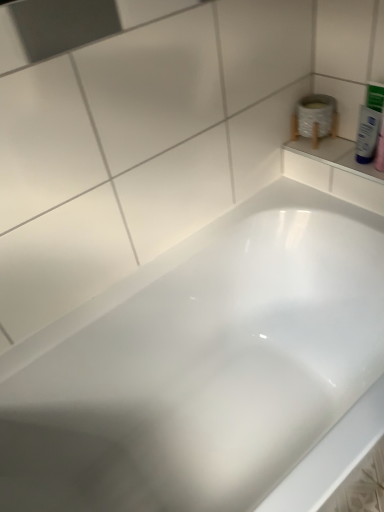
Question: From the image's perspective, is white glossy bathtub at center positioned above or below white glossy tube at upper right?

Choices:
 (A) below
 (B) above

Answer: (A)

Question: Is white glossy bathtub at center wider or thinner than white glossy tube at upper right?

Choices:
 (A) thin
 (B) wide

Answer: (B)

Question: Is white glossy bathtub at center situated inside white glossy tube at upper right or outside?

Choices:
 (A) inside
 (B) outside

Answer: (B)

Question: From a real-world perspective, is white glossy tube at upper right positioned above or below white glossy bathtub at center?

Choices:
 (A) below
 (B) above

Answer: (B)

Question: Considering the positions of white glossy tube at upper right and white glossy bathtub at center in the image, is white glossy tube at upper right bigger or smaller than white glossy bathtub at center?

Choices:
 (A) small
 (B) big

Answer: (A)

Question: Considering their positions, is white glossy tube at upper right located in front of or behind white glossy bathtub at center?

Choices:
 (A) front
 (B) behind

Answer: (B)

Question: Considering the relative positions of white glossy tube at upper right and white glossy bathtub at center in the image provided, is white glossy tube at upper right to the left or to the right of white glossy bathtub at center?

Choices:
 (A) right
 (B) left

Answer: (A)